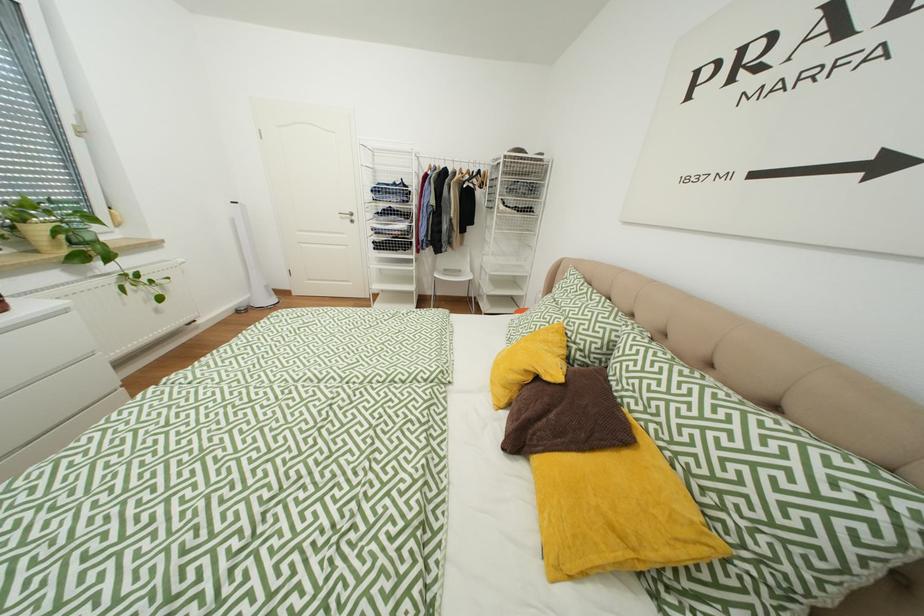
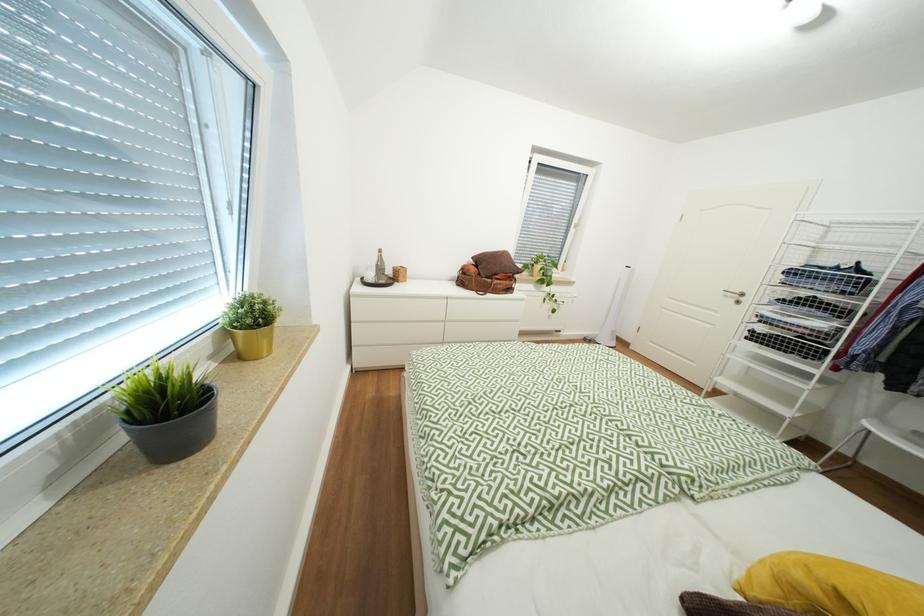
Question: The camera is either moving clockwise (left) or counter-clockwise (right) around the object. The first image is from the beginning of the video and the second image is from the end. Is the camera moving left or right when shooting the video?

Choices:
 (A) Left
 (B) Right

Answer: (B)